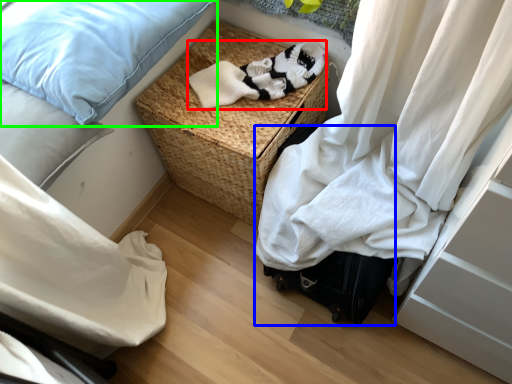
Question: Which object is positioned closest to clothing (highlighted by a red box)? Select from luggage (highlighted by a blue box) and pillow (highlighted by a green box).

Choices:
 (A) luggage
 (B) pillow

Answer: (B)